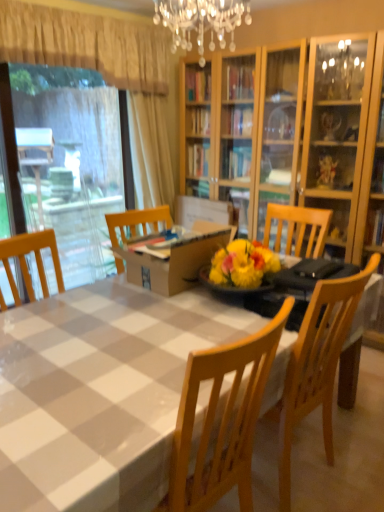
At what (x,y) coordinates should I click in order to perform the action: click on empty space that is ontop of white checkered tablecloth at center (from a real-world perspective). Please return your answer as a coordinate pair (x, y). This screenshot has width=384, height=512. Looking at the image, I should click on (125, 333).